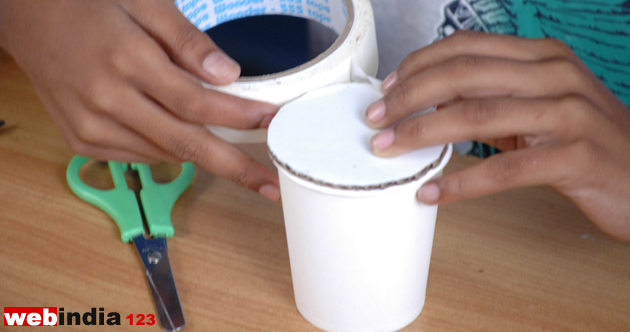
Identify the location of light brown table. The height and width of the screenshot is (332, 630). (488, 276).